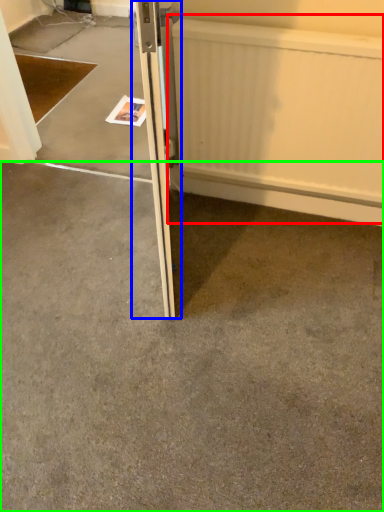
Question: Which object is the closest to the radiator (highlighted by a red box)? Choose among these: door (highlighted by a blue box) or concrete (highlighted by a green box).

Choices:
 (A) door
 (B) concrete

Answer: (A)